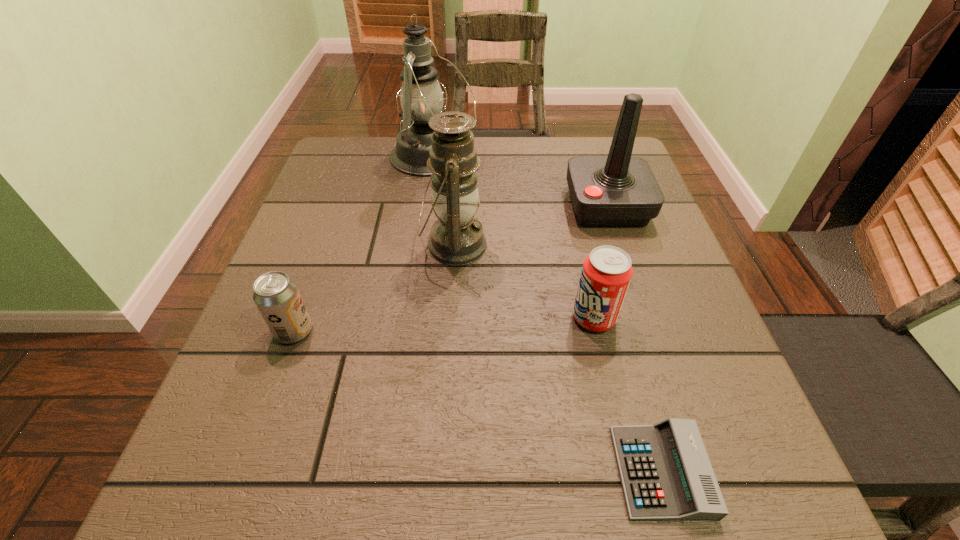
The image size is (960, 540). What are the coordinates of `vacant region located on the right of the nearer oil lamp` in the screenshot? It's located at (625, 246).

Image resolution: width=960 pixels, height=540 pixels. Find the location of `vacant space situated on the front of the joystick`. vacant space situated on the front of the joystick is located at coordinates (624, 257).

Locate an element on the screen. The image size is (960, 540). vacant space located 0.350m on the surface of the soda can is located at coordinates [x=377, y=318].

Find the location of a particular element. vacant region located 0.380m on the surface of the soda can is located at coordinates (361, 318).

Locate an element on the screen. This screenshot has width=960, height=540. free space located 0.260m on the surface of the soda can is located at coordinates (427, 318).

Identify the location of free space located on the right of the beer can. (416, 331).

Find the location of `blank space located 0.210m on the back of the shortest object`. blank space located 0.210m on the back of the shortest object is located at coordinates (618, 317).

The image size is (960, 540). Identify the location of oil lamp positioned at the far edge. (421, 97).

Locate an element on the screen. This screenshot has height=540, width=960. joystick situated at the far edge is located at coordinates (619, 190).

The width and height of the screenshot is (960, 540). Identify the location of object positioned at the near edge. (666, 474).